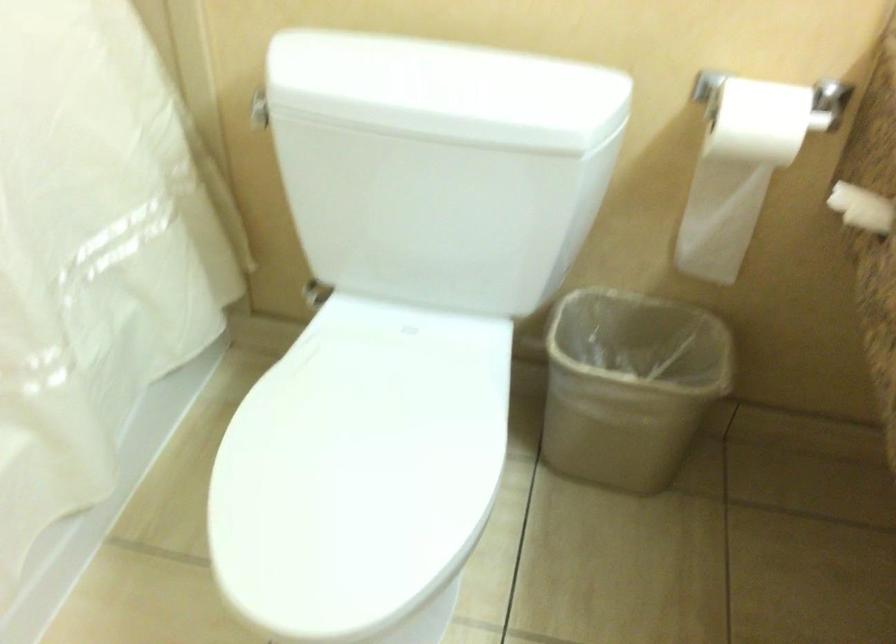
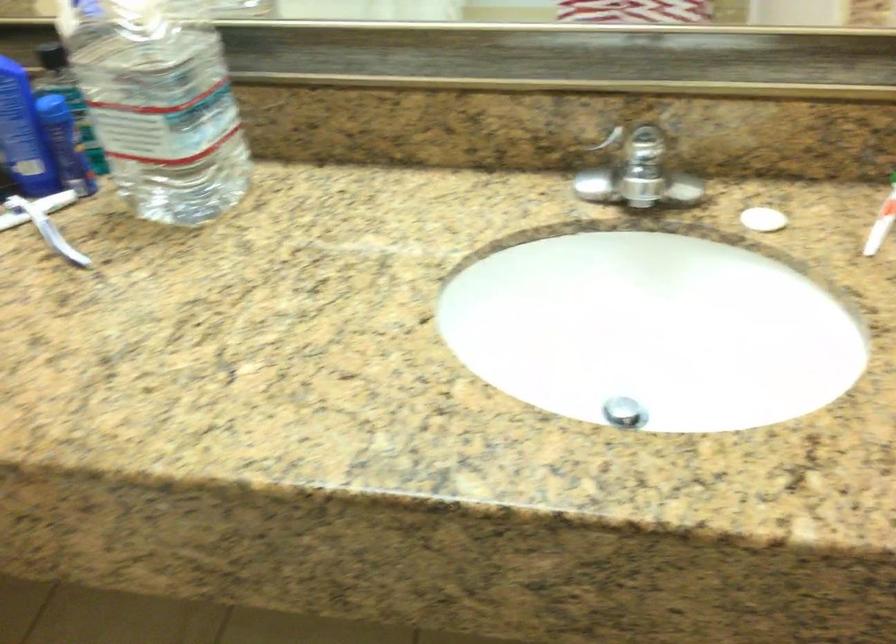
How did the camera likely rotate?

The rotation direction of the camera is right-down.